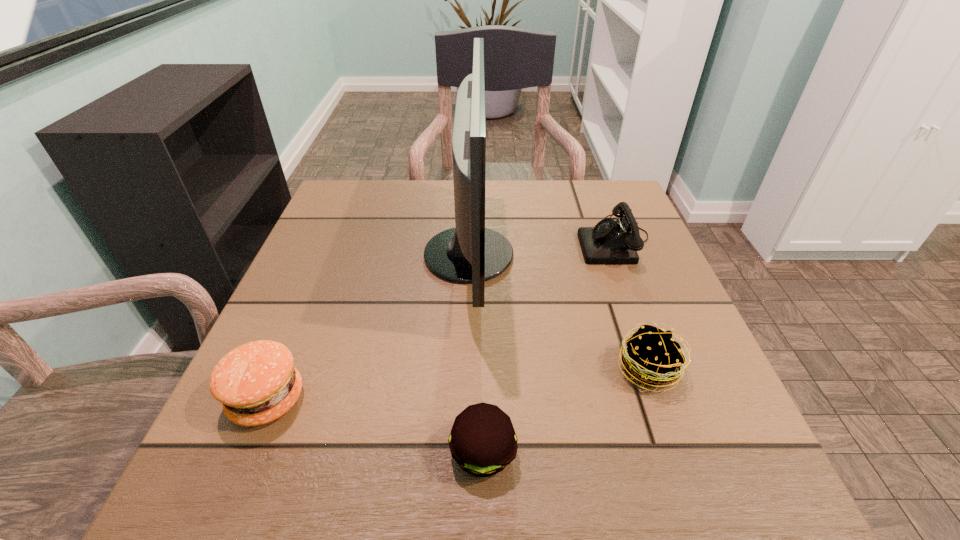
The height and width of the screenshot is (540, 960). In order to click on unoccupied position between the leftmost object and the tallest object in this screenshot , I will do `click(368, 327)`.

Locate an element on the screen. The image size is (960, 540). vacant area that lies between the monitor and the second patty from right to left is located at coordinates (476, 354).

Where is `free area in between the second patty from right to left and the monitor`? free area in between the second patty from right to left and the monitor is located at coordinates (476, 354).

Identify the location of object that is the fourth closest to the tallest object. The image size is (960, 540). (257, 383).

Image resolution: width=960 pixels, height=540 pixels. What are the coordinates of `object that stands as the fourth closest to the rightmost patty` in the screenshot? It's located at (257, 383).

Select which patty is the closest to the telephone. Please provide its 2D coordinates. Your answer should be formatted as a tuple, i.e. [(x, y)], where the tuple contains the x and y coordinates of a point satisfying the conditions above.

[(653, 357)]

This screenshot has width=960, height=540. In order to click on the second closest patty to the second patty from right to left in this screenshot , I will do `click(257, 383)`.

Where is `free point that satisfies the following two spatial constraints: 1. on the front side of the second patty from right to left; 2. on the right side of the leftmost patty`? This screenshot has height=540, width=960. free point that satisfies the following two spatial constraints: 1. on the front side of the second patty from right to left; 2. on the right side of the leftmost patty is located at coordinates (245, 453).

You are a GUI agent. You are given a task and a screenshot of the screen. Output one action in this format:
    pyautogui.click(x=<x>, y=<y>)
    Task: Click on the free location that satisfies the following two spatial constraints: 1. on the screen side of the tallest object; 2. on the right side of the rightmost patty
    
    Given the screenshot: What is the action you would take?
    pyautogui.click(x=466, y=369)

Find the location of a particular element. This screenshot has height=540, width=960. free space in the image that satisfies the following two spatial constraints: 1. on the front face of the telephone; 2. on the front side of the rightmost patty is located at coordinates (664, 369).